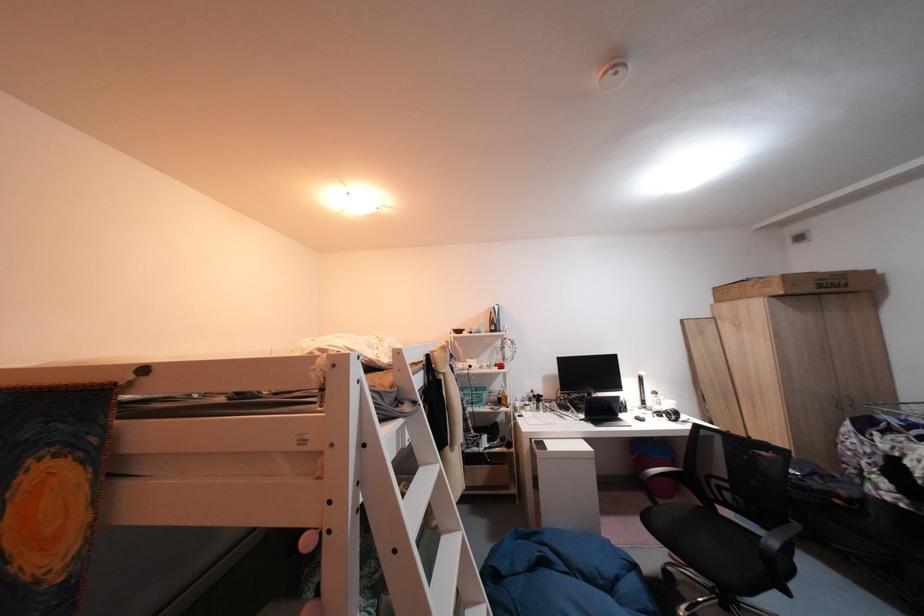
The height and width of the screenshot is (616, 924). Describe the element at coordinates (710, 546) in the screenshot. I see `a chair sitting surface` at that location.